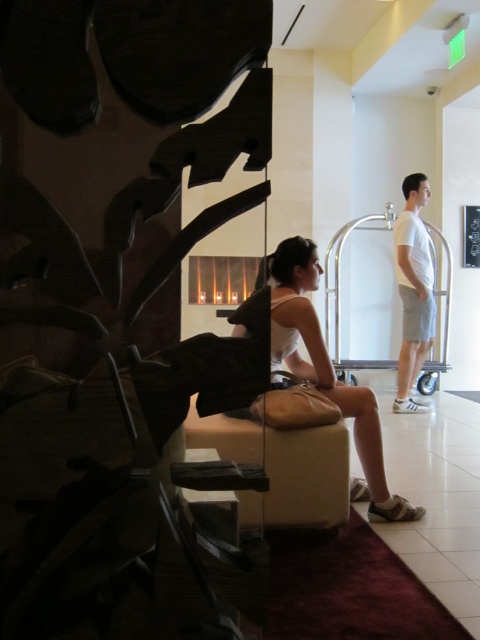
You are standing in the hotel lobby and want to place a 3D printed model of the sculpture on the floor. The model is 2.5 meters tall. If you position it at the point marked by coordinates point (x=196, y=429), will it fit without exceeding the space available?

The point (x=196, y=429) is 2.51 meters away from the viewer. Since the model is 2.5 meters tall, it will fit as the distance allows sufficient space.